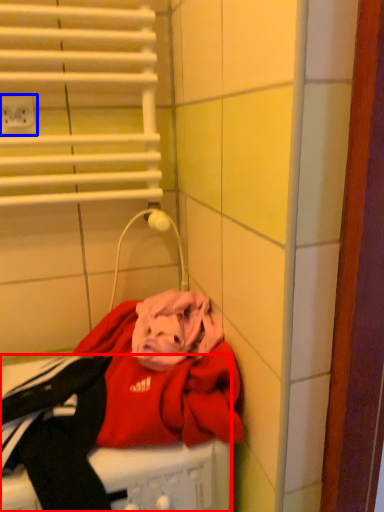
Question: Which of the following is the farthest to the observer, washing machine (highlighted by a red box) or electric outlet (highlighted by a blue box)?

Choices:
 (A) washing machine
 (B) electric outlet

Answer: (B)